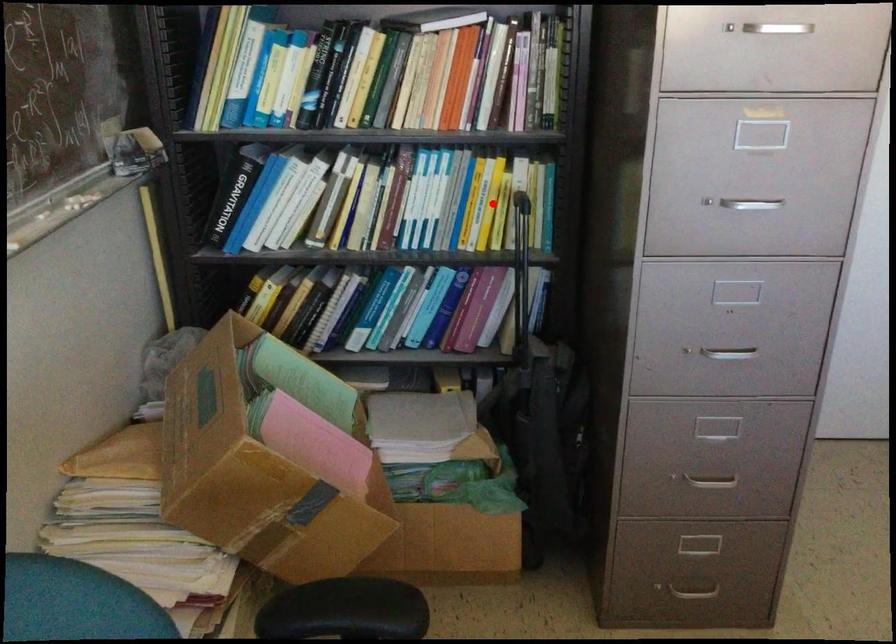
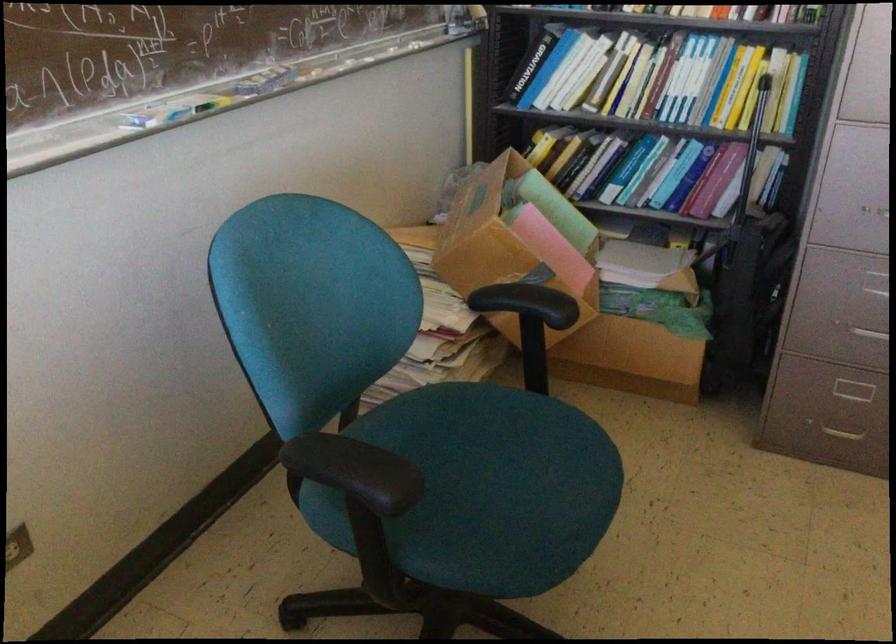
Find the pixel in the second image that matches the highlighted location in the first image.

(745, 86)